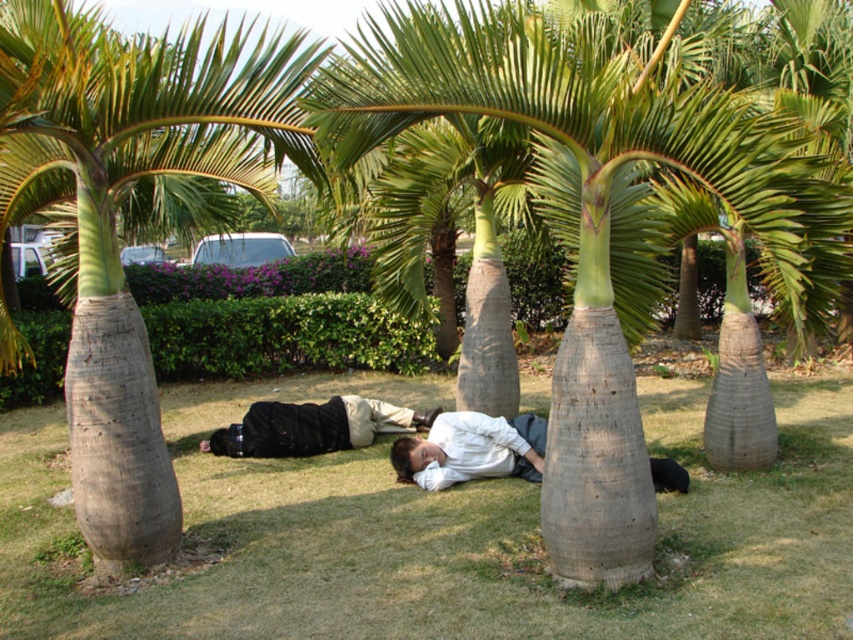
You are planning to set up a picnic blanket in the center of this grassy area. Given the presence of the green grass at center and the smooth gray trunk at center, which of these two objects takes up more space in the central area?

The smooth gray trunk at center occupies more space in the central area than the green grass at center.